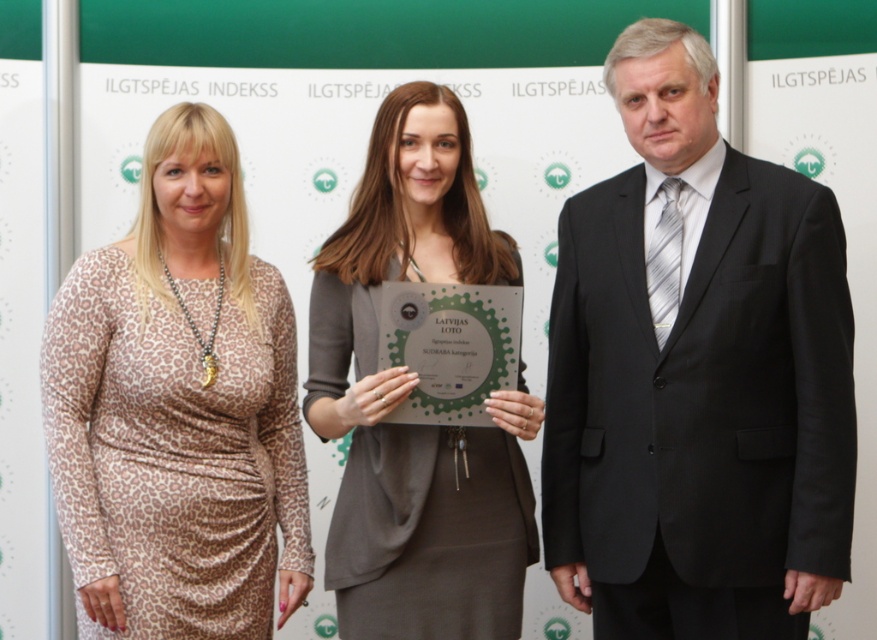
You are a photographer at a formal event. You need to capture a photo where the leopard print dress at left and the matte gray dress at center are both visible. Based on their positions, which dress will appear closer to the camera in the photo?

The leopard print dress at left will appear closer to the camera because it is in front of the matte gray dress at center.

What is the position of the black suit at right in the image?

The black suit at right is located at point 0.586 on the horizontal axis and 0.795 on the vertical axis.